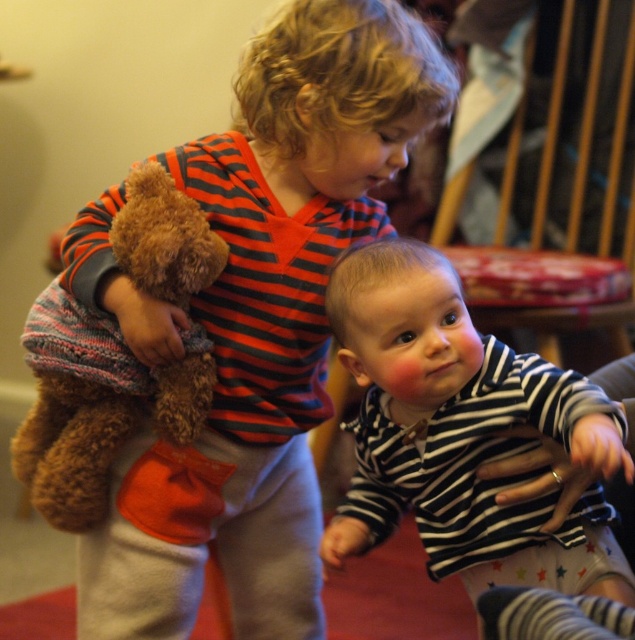
Does soft brown teddy bear at center have a greater width compared to striped cotton shirt at center?

Indeed, soft brown teddy bear at center has a greater width compared to striped cotton shirt at center.

Is soft brown teddy bear at center taller than striped cotton shirt at center?

Yes, soft brown teddy bear at center is taller than striped cotton shirt at center.

Which is behind, point (211, 513) or point (558, 376)?

Positioned behind is point (211, 513).

Locate an element on the screen. This screenshot has height=640, width=635. soft brown teddy bear at center is located at coordinates (265, 324).

Does point (436, 332) come behind point (138, 221)?

That is False.

Who is shorter, striped cotton shirt at center or brown plush teddy bear at left?

striped cotton shirt at center is shorter.

Describe the element at coordinates (462, 433) in the screenshot. This screenshot has width=635, height=640. I see `striped cotton shirt at center` at that location.

Locate an element on the screen. striped cotton shirt at center is located at coordinates (462, 433).

Can you confirm if soft brown teddy bear at center is taller than brown plush teddy bear at left?

Indeed, soft brown teddy bear at center has a greater height compared to brown plush teddy bear at left.

The width and height of the screenshot is (635, 640). Find the location of `soft brown teddy bear at center`. soft brown teddy bear at center is located at coordinates (265, 324).